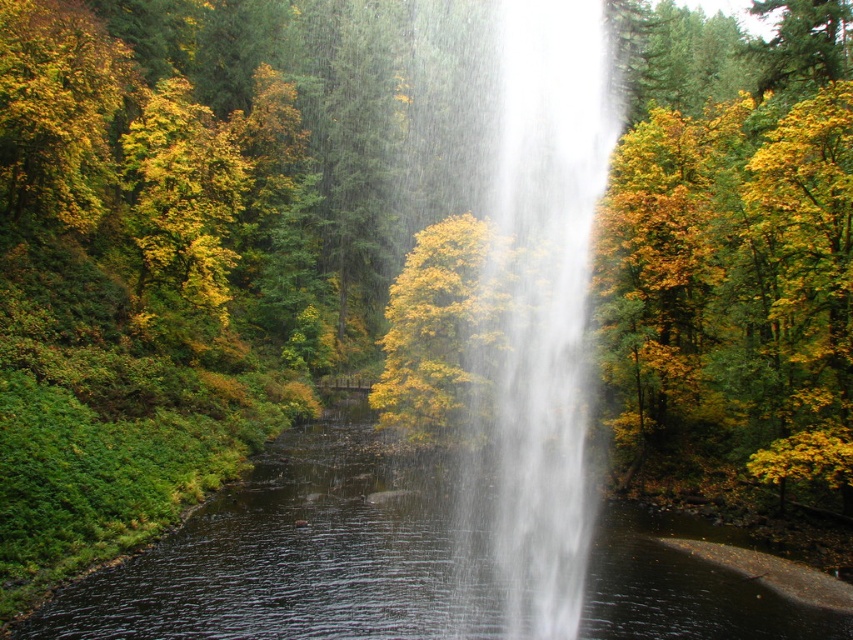
Question: Which point appears closest to the camera in this image?

Choices:
 (A) (161, 614)
 (B) (492, 108)

Answer: (A)

Question: Is white misty waterfall at center smaller than transparent water at center?

Choices:
 (A) no
 (B) yes

Answer: (A)

Question: Which point appears closest to the camera in this image?

Choices:
 (A) (447, 609)
 (B) (412, 552)

Answer: (A)

Question: Among these objects, which one is farthest from the camera?

Choices:
 (A) transparent water at center
 (B) white misty waterfall at center

Answer: (B)

Question: Is white misty waterfall at center to the left of transparent water at center from the viewer's perspective?

Choices:
 (A) no
 (B) yes

Answer: (A)

Question: Does white misty waterfall at center appear on the left side of transparent water at center?

Choices:
 (A) no
 (B) yes

Answer: (A)